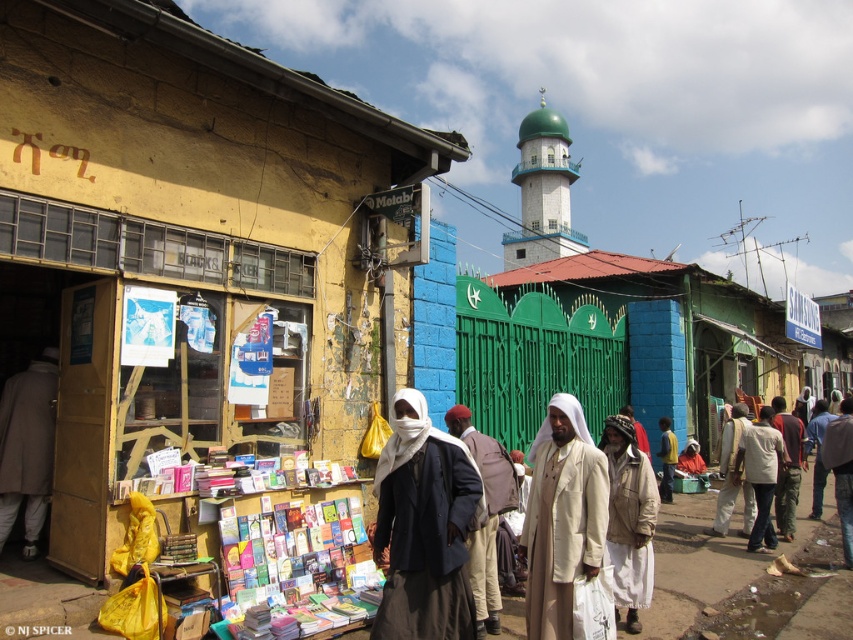
Question: Which of these objects is positioned closest to the beige fabric coat at center?

Choices:
 (A) light beige fabric at center
 (B) light brown fabric jacket at center

Answer: (A)

Question: Is the position of beige fabric coat at center more distant than that of light beige fabric headscarf at center?

Choices:
 (A) yes
 (B) no

Answer: (B)

Question: Which point is closer to the camera?

Choices:
 (A) (505, 468)
 (B) (784, 474)
 (C) (722, 513)
 (D) (19, 474)

Answer: (A)

Question: Is light brown fabric jacket at center positioned before light beige fabric headscarf at center?

Choices:
 (A) yes
 (B) no

Answer: (A)

Question: Which point is closer to the camera?

Choices:
 (A) light brown fabric jacket at center
 (B) gray woolen coat at left

Answer: (B)

Question: Does beige fabric coat at center have a smaller size compared to light beige fabric headscarf at center?

Choices:
 (A) no
 (B) yes

Answer: (A)